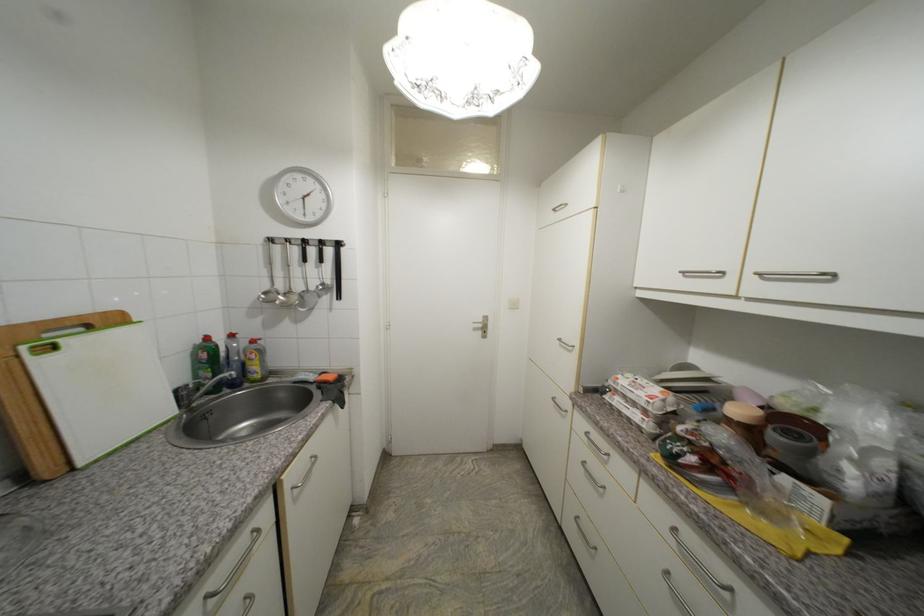
Find the location of `tape roll`. tape roll is located at coordinates (812, 430).